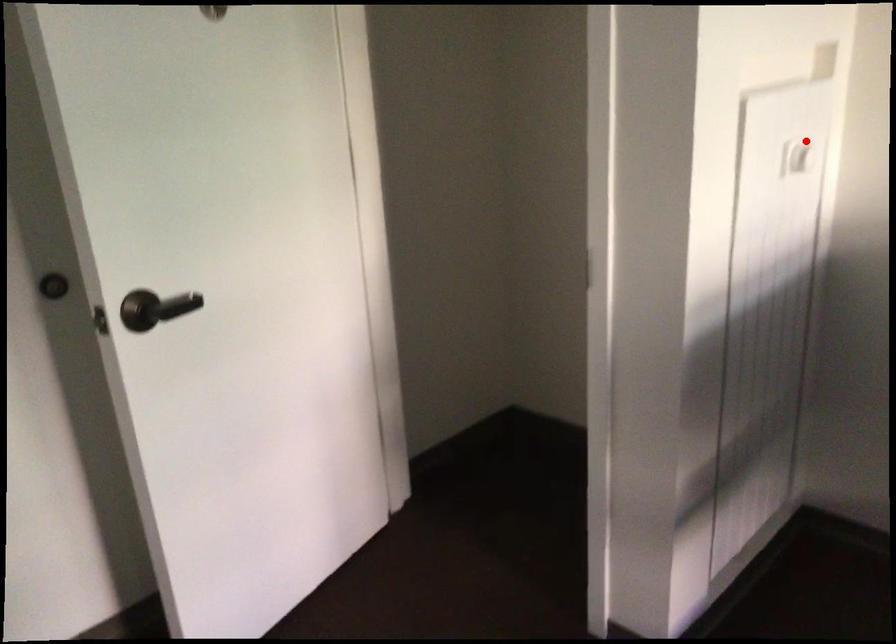
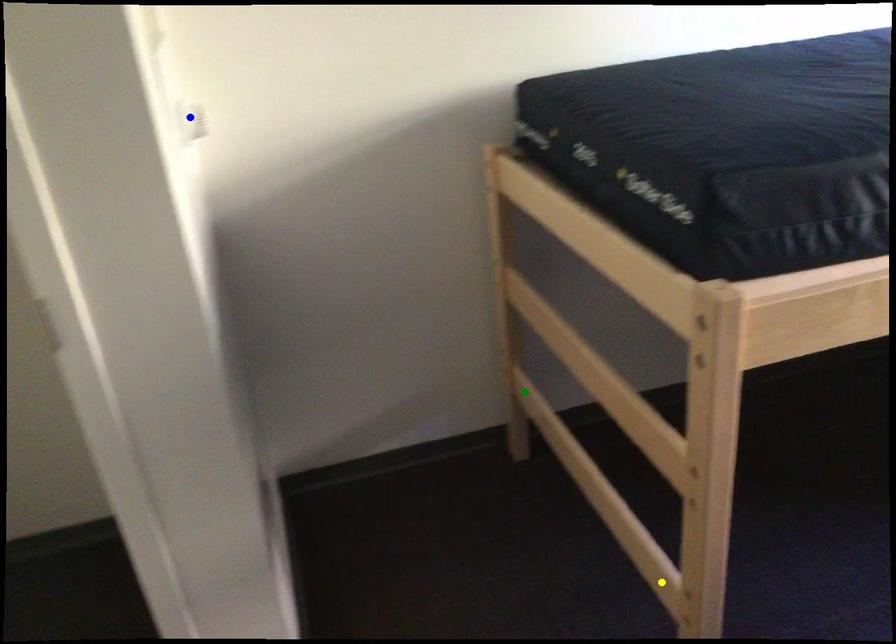
Question: I am providing you with two images of the same scene from different viewpoints. A red point is marked on the first image. You are given multiple points on the second image. Which point in image 2 represents the same 3d spot as the red point in image 1?

Choices:
 (A) green point
 (B) yellow point
 (C) blue point

Answer: (C)